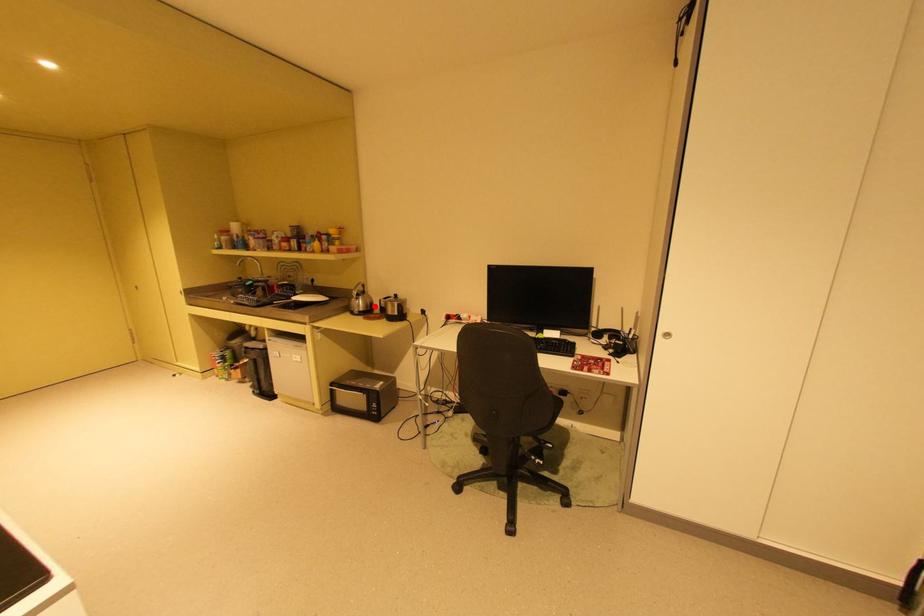
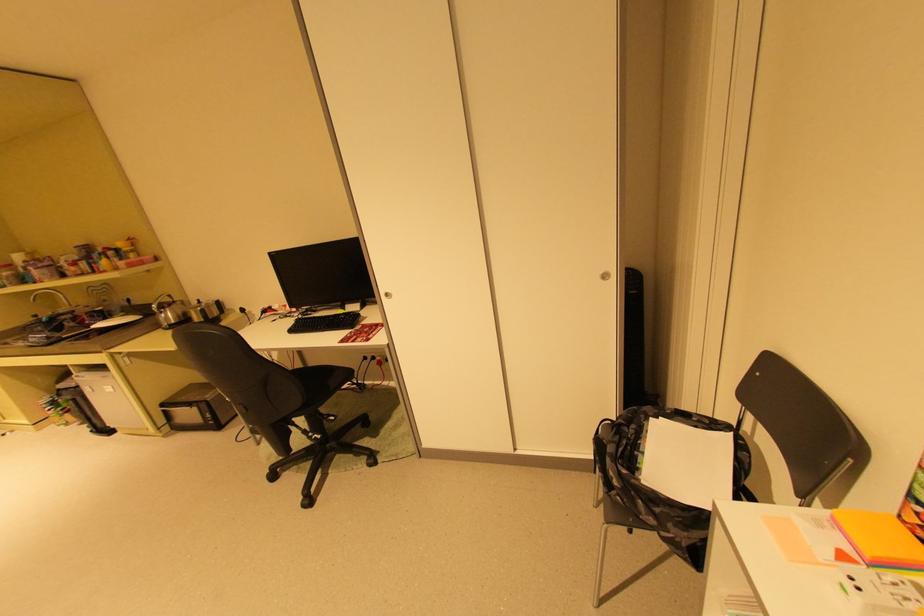
Find the pixel in the second image that matches the highlighted location in the first image.

(187, 317)